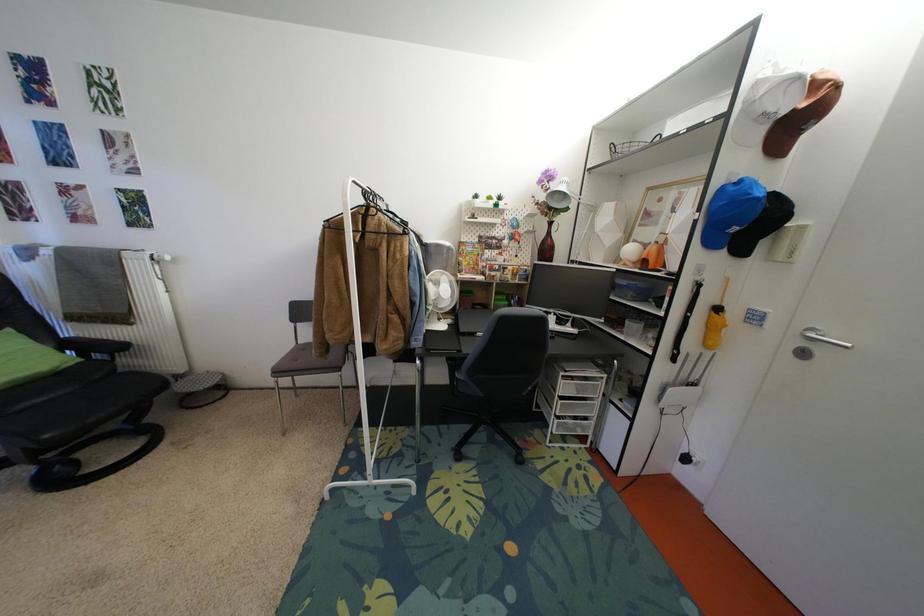
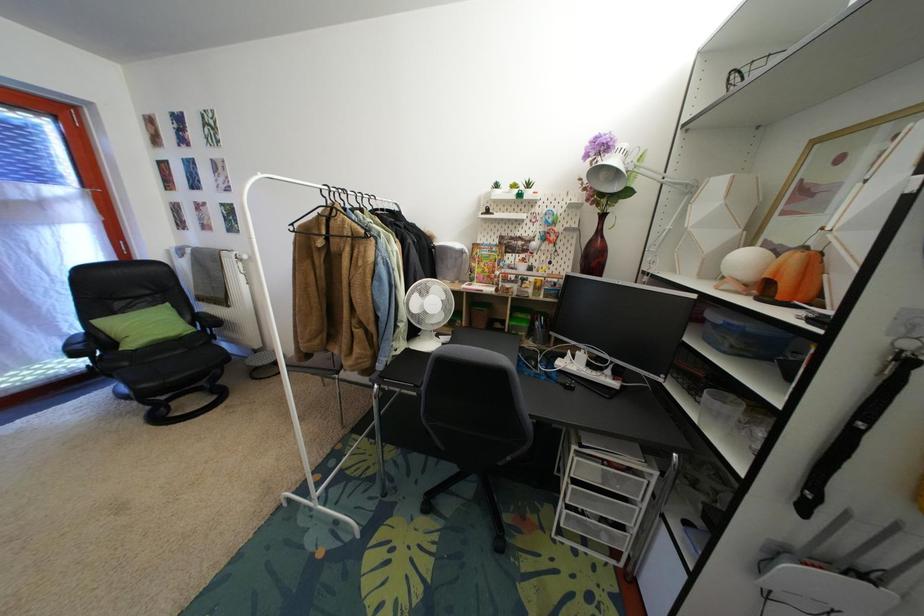
Question: The camera is either moving clockwise (left) or counter-clockwise (right) around the object. The first image is from the beginning of the video and the second image is from the end. Is the camera moving left or right when shooting the video?

Choices:
 (A) Left
 (B) Right

Answer: (B)